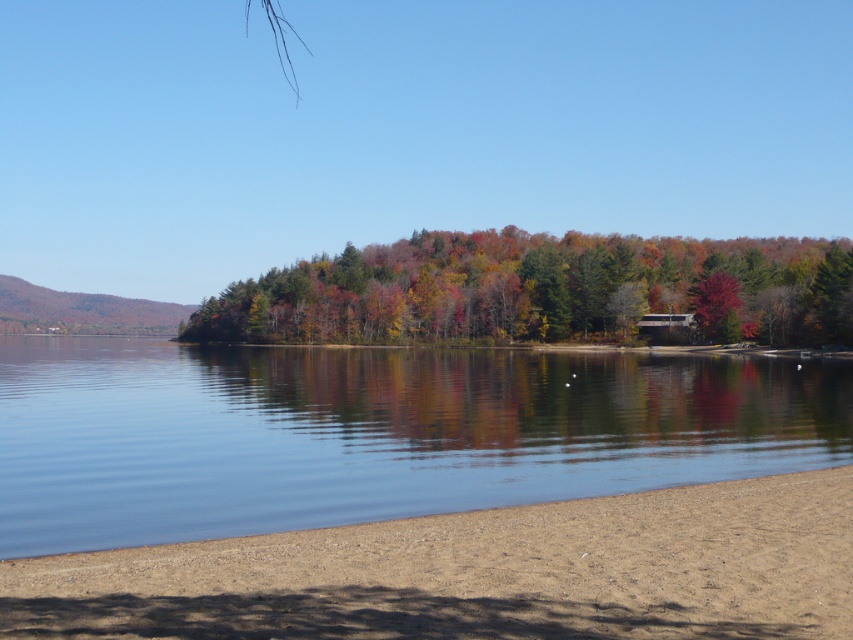
Looking at this image, you are planning to build a small dock on the lakeside. The dock needs to be as wide as the brown sandy beach at lower center. Can the clear water at center accommodate the dock in terms of width?

The clear water at center is wider than the brown sandy beach at lower center, so yes, the dock can be accommodated in terms of width since the water is wide enough to support it.

You are standing at the point marked by the coordinates point (374, 433) in the image. What is the type of water you are currently on?

Answer: The point (374, 433) marks clear water at center, so you are currently on clear water at center.